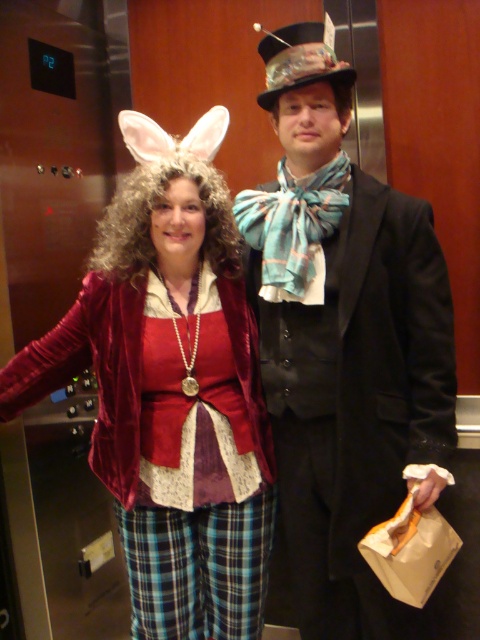
You are designing a new elevator interior and need to ensure that both the shiny black suit at center and the velvet red jacket at center can be accommodated comfortably. Given that the elevator has limited space, which of the two outfits should be prioritized for fitting into a narrower compartment?

The shiny black suit at center is thinner than the velvet red jacket at center, so it can fit into a narrower compartment more easily. Therefore, the shiny black suit at center should be prioritized for fitting into a narrower compartment.

You are an interior designer assessing the placement of a new metallic sculpture in an elevator. The elevator has a control panel and metallic walls. There is a point marked at coordinates [343,340] which indicates the location of a shiny black suit at center. Where should you place the sculpture to avoid blocking the shiny black suit at center?

The point marked at coordinates [343,340] indicates the location of the shiny black suit at center. To avoid blocking it, the metallic sculpture should be placed away from this central area, perhaps near the walls or corners of the elevator where there is more space and fewer obstructions.

You are an elevator maintenance worker checking the elevator for safety. You notice the shiny black suit at center and the velvet red jacket at center. Which clothing item is covering the other one?

The shiny black suit at center is positioned over the velvet red jacket at center, so the shiny black suit is covering the velvet red jacket.